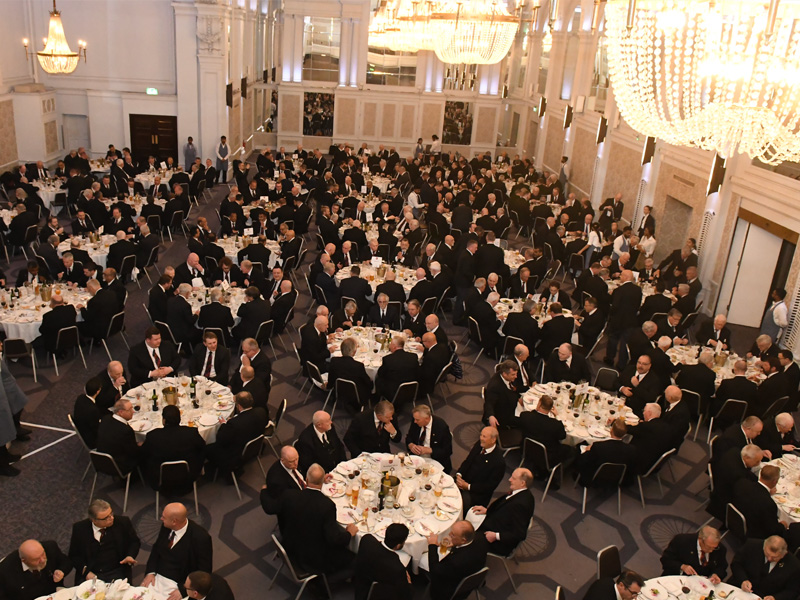
At what (x,y) coordinates should I click in order to perform the action: click on mirrors. Please return your answer as a coordinate pair (x, y). The width and height of the screenshot is (800, 600). Looking at the image, I should click on (324, 115), (462, 119), (324, 51), (386, 58), (453, 77).